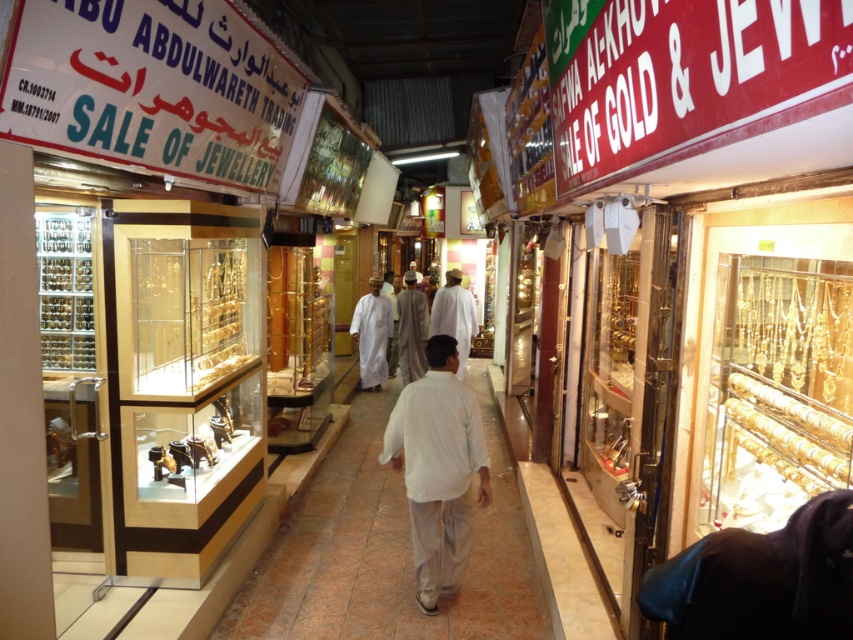
Question: Which point is closer to the camera?

Choices:
 (A) white cloth at center
 (B) white cotton shirt at center
 (C) light beige fabric at center

Answer: (B)

Question: Can you confirm if white cotton robe at center is wider than white cloth at center?

Choices:
 (A) yes
 (B) no

Answer: (B)

Question: Can you confirm if white cloth at center is thinner than light beige fabric at center?

Choices:
 (A) no
 (B) yes

Answer: (A)

Question: Which object is positioned farthest from the light beige fabric at center?

Choices:
 (A) white cloth at center
 (B) white cotton robe at center

Answer: (B)

Question: Is white cotton robe at center positioned behind light beige fabric at center?

Choices:
 (A) no
 (B) yes

Answer: (B)

Question: Which point is closer to the camera taking this photo?

Choices:
 (A) (477, 433)
 (B) (370, 380)
 (C) (399, 374)
 (D) (451, 268)

Answer: (A)